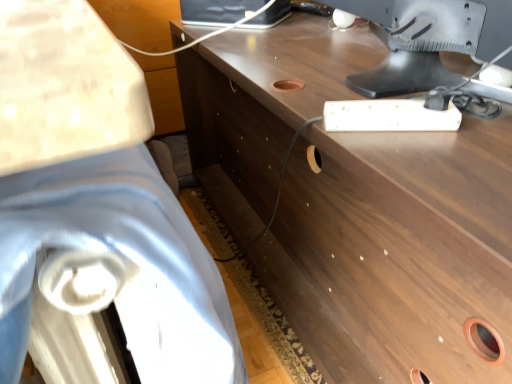
In order to face white fabric swivel chair at left, should I rotate leftwards or rightwards?

You should look left and rotate roughly 20.725 degrees.

Locate an element on the screen. brown wood desk at center is located at coordinates (396, 250).

Identify the location of white fabric swivel chair at left. (98, 193).

Measure the distance from satin silver monitor at upper right to brown wood desk at center.

satin silver monitor at upper right is 11.30 inches from brown wood desk at center.

Between satin silver monitor at upper right and brown wood desk at center, which one appears on the right side from the viewer's perspective?

satin silver monitor at upper right is more to the right.

Looking at this image, is satin silver monitor at upper right shorter than brown wood desk at center?

Correct, satin silver monitor at upper right is not as tall as brown wood desk at center.

Would you say satin silver monitor at upper right is a long distance from brown wood desk at center?

No, satin silver monitor at upper right is in close proximity to brown wood desk at center.

Is white fabric swivel chair at left at the back of brown wood desk at center?

Absolutely, brown wood desk at center is directed away from white fabric swivel chair at left.

From a real-world perspective, is brown wood desk at center below white fabric swivel chair at left?

Yes, from a real-world perspective, brown wood desk at center is under white fabric swivel chair at left.

Is brown wood desk at center not near white fabric swivel chair at left?

They are positioned close to each other.

From the picture: Does brown wood desk at center appear on the right side of white fabric swivel chair at left?

Correct, you'll find brown wood desk at center to the right of white fabric swivel chair at left.

Which object is closer to the camera, white fabric swivel chair at left or satin silver monitor at upper right?

white fabric swivel chair at left is closer to the camera.

Is white fabric swivel chair at left positioned with its back to satin silver monitor at upper right?

No.

Would you say white fabric swivel chair at left is a long distance from satin silver monitor at upper right?

white fabric swivel chair at left is actually quite close to satin silver monitor at upper right.

Is point (126, 242) positioned in front of point (383, 75)?

That is True.

From the image's perspective, is brown wood desk at center above or below satin silver monitor at upper right?

brown wood desk at center is situated lower than satin silver monitor at upper right in the image.

From the picture: Is there a large distance between brown wood desk at center and satin silver monitor at upper right?

No, brown wood desk at center is not far from satin silver monitor at upper right.

How different are the orientations of brown wood desk at center and satin silver monitor at upper right in degrees?

The angular difference between brown wood desk at center and satin silver monitor at upper right is 0.357 degrees.

Is brown wood desk at center to the right of satin silver monitor at upper right from the viewer's perspective?

No, brown wood desk at center is not to the right of satin silver monitor at upper right.

Identify the location of swivel chair below the brown wood desk at center (from the image's perspective). (98, 193).

Considering the positions of objects white fabric swivel chair at left and brown wood desk at center in the image provided, who is more to the right, white fabric swivel chair at left or brown wood desk at center?

From the viewer's perspective, brown wood desk at center appears more on the right side.

Does white fabric swivel chair at left turn towards brown wood desk at center?

Yes, white fabric swivel chair at left is turned towards brown wood desk at center.

Which is behind, point (53, 139) or point (268, 128)?

The point (268, 128) is behind.

Is satin silver monitor at upper right facing away from white fabric swivel chair at left?

Yes.

Is satin silver monitor at upper right bigger or smaller than white fabric swivel chair at left?

Considering their sizes, satin silver monitor at upper right takes up less space than white fabric swivel chair at left.

Measure the distance between satin silver monitor at upper right and white fabric swivel chair at left.

They are 59.67 centimeters apart.

Do you think satin silver monitor at upper right is within white fabric swivel chair at left, or outside of it?

satin silver monitor at upper right is not inside white fabric swivel chair at left, it's outside.

Locate an element on the screen. The width and height of the screenshot is (512, 384). computer monitor that appears above the brown wood desk at center (from the image's perspective) is located at coordinates (414, 42).

At what (x,y) coordinates should I click in order to perform the action: click on swivel chair in front of the brown wood desk at center. Please return your answer as a coordinate pair (x, y). Looking at the image, I should click on (98, 193).

In the scene shown: Estimate the real-world distances between objects in this image. Which object is closer to satin silver monitor at upper right, white fabric swivel chair at left or brown wood desk at center?

Based on the image, brown wood desk at center appears to be nearer to satin silver monitor at upper right.

Which object lies further to the anchor point satin silver monitor at upper right, brown wood desk at center or white fabric swivel chair at left?

white fabric swivel chair at left lies further to satin silver monitor at upper right than the other object.

Which object lies nearer to the anchor point brown wood desk at center, satin silver monitor at upper right or white fabric swivel chair at left?

satin silver monitor at upper right is positioned closer to the anchor brown wood desk at center.

In the scene shown: Looking at the image, which one is located further to brown wood desk at center, white fabric swivel chair at left or satin silver monitor at upper right?

white fabric swivel chair at left lies further to brown wood desk at center than the other object.

When comparing their distances from white fabric swivel chair at left, does satin silver monitor at upper right or brown wood desk at center seem closer?

brown wood desk at center is closer to white fabric swivel chair at left.

When comparing their distances from white fabric swivel chair at left, does brown wood desk at center or satin silver monitor at upper right seem closer?

Based on the image, brown wood desk at center appears to be nearer to white fabric swivel chair at left.

Find the location of `desk located between white fabric swivel chair at left and satin silver monitor at upper right in the left-right direction`. desk located between white fabric swivel chair at left and satin silver monitor at upper right in the left-right direction is located at coordinates (396, 250).